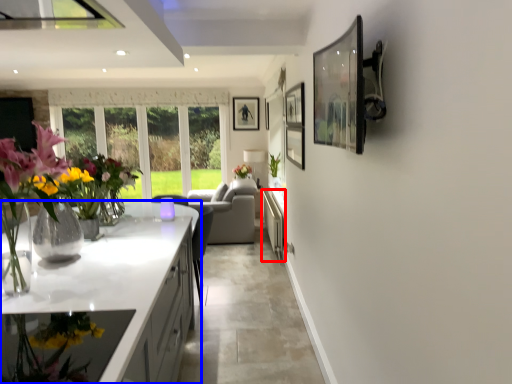
Question: Which of the following is the farthest to the observer, cabinetry (highlighted by a red box) or countertop (highlighted by a blue box)?

Choices:
 (A) cabinetry
 (B) countertop

Answer: (A)